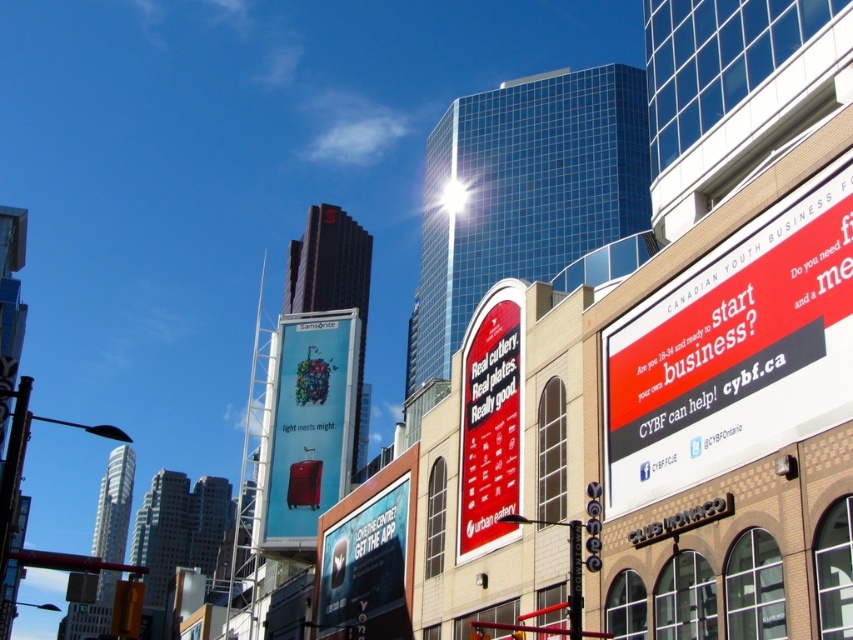
You are a city planner assessing the visual impact of signs in the downtown area. You notice the red matte sign at center and the white glossy billboard at center. Which sign is taller?

The red matte sign at center is much taller than the white glossy billboard at center.

You are a traveler standing in the urban area and see both the matte plastic suitcase at center and the white glossy billboard at center. Which object is closer to you?

The matte plastic suitcase at center is closer to you because it is further to the viewer than the white glossy billboard at center.

You are standing at the point marked by the coordinates (308, 426) in the urban scene. What object is located exactly at this point?

The matte plastic suitcase at center is located exactly at the coordinates (308, 426).